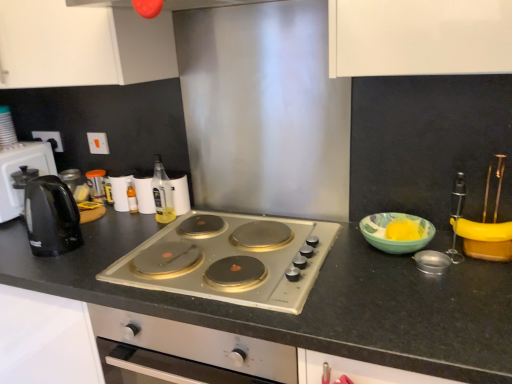
Where is `vacant space situated on the left part of matte green bowl at right`? The height and width of the screenshot is (384, 512). vacant space situated on the left part of matte green bowl at right is located at coordinates (348, 256).